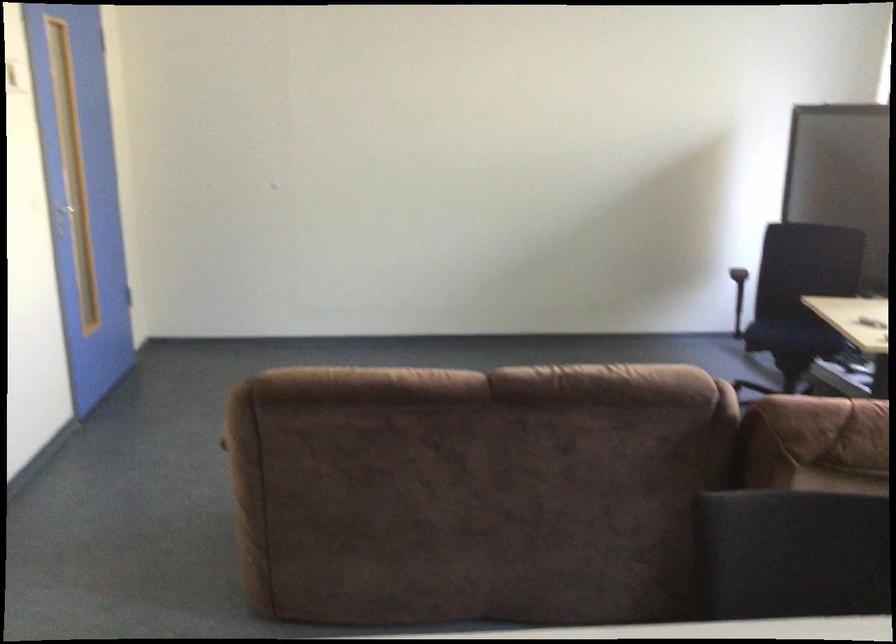
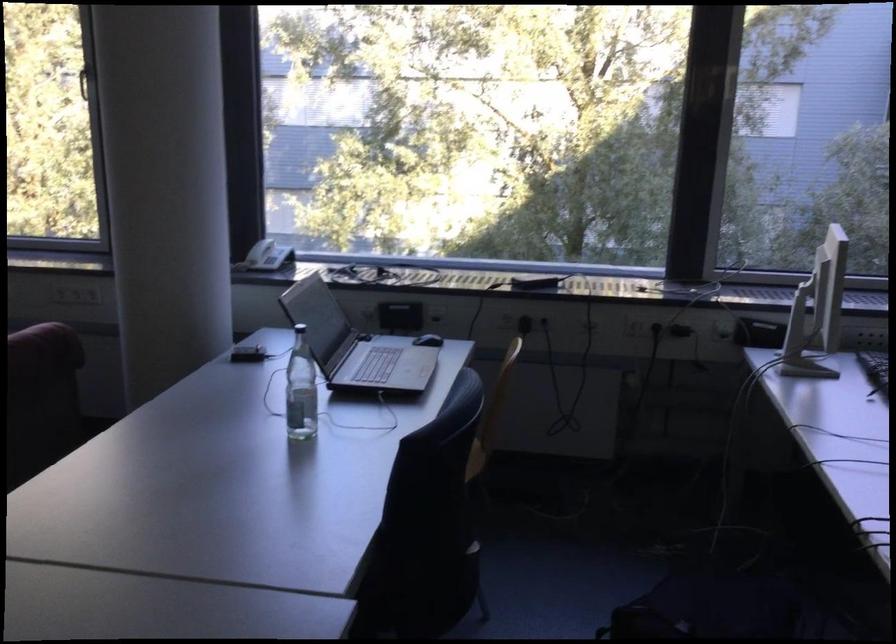
Question: The first image is from the beginning of the video and the second image is from the end. How did the camera likely rotate when shooting the video?

Choices:
 (A) Left
 (B) Right
 (C) Up
 (D) Down

Answer: (B)